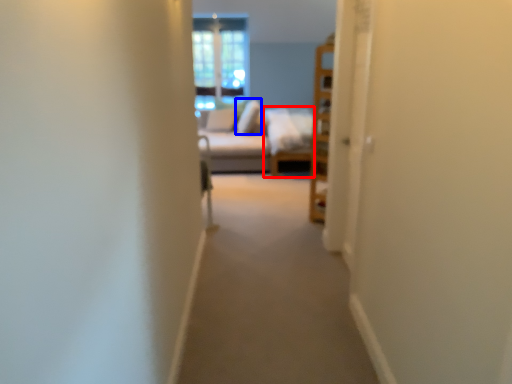
Question: Which object is further to the camera taking this photo, couch (highlighted by a red box) or pillow (highlighted by a blue box)?

Choices:
 (A) couch
 (B) pillow

Answer: (B)